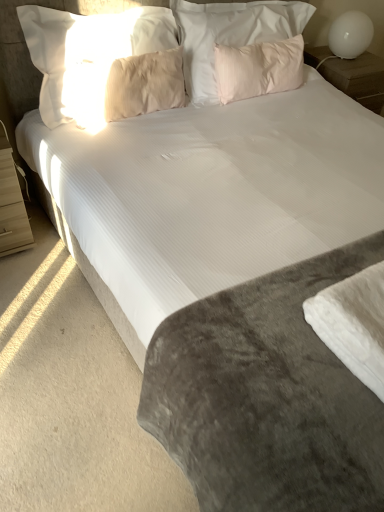
Question: Considering the positions of point (349, 16) and point (6, 144), is point (349, 16) closer or farther from the camera than point (6, 144)?

Choices:
 (A) farther
 (B) closer

Answer: (A)

Question: Considering their positions, is white glossy table lamp at upper right located in front of or behind light wood nightstand at left, the 1th nightstand when ordered from front to back?

Choices:
 (A) front
 (B) behind

Answer: (B)

Question: Which object is the closest to the beige soft pillow at upper center, the 1th pillow in the left-to-right sequence?

Choices:
 (A) light wood nightstand at left, the 1th nightstand viewed from the left
 (B) pink soft pillow at upper center, marked as the third pillow in a left-to-right arrangement
 (C) white glossy nightstand at upper right, positioned as the 2th nightstand in front-to-back order
 (D) beige soft pillow at upper left, placed as the third pillow when sorted from right to left
 (E) white soft fabric at lower right

Answer: (D)

Question: Which is nearer to the light wood nightstand at left, the 1th nightstand in the bottom-to-top sequence?

Choices:
 (A) velvety gray mattress at center
 (B) pink soft pillow at upper center, marked as the third pillow in a left-to-right arrangement
 (C) white glossy nightstand at upper right, positioned as the 2th nightstand in front-to-back order
 (D) white soft fabric at lower right
 (E) beige soft pillow at upper left, the second pillow viewed from the left

Answer: (E)